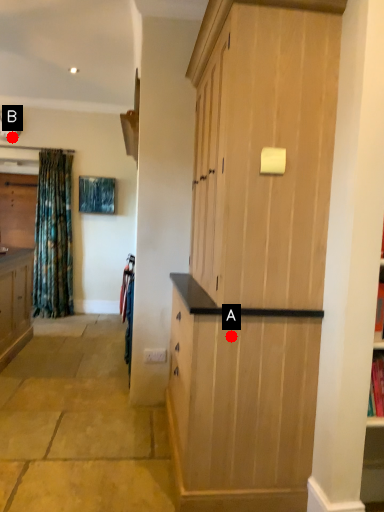
Question: Two points are circled on the image, labeled by A and B beside each circle. Which of the following is the farthest from the observer?

Choices:
 (A) A is further
 (B) B is further

Answer: (B)